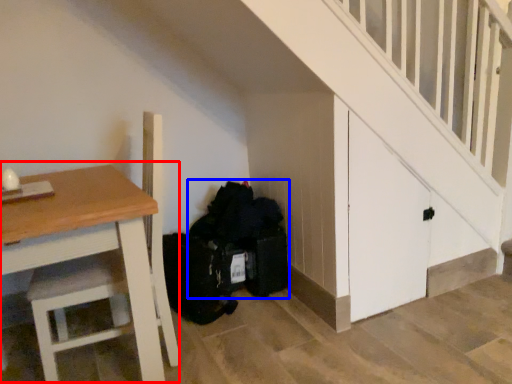
Question: Among these objects, which one is nearest to the camera, table (highlighted by a red box) or garbage (highlighted by a blue box)?

Choices:
 (A) table
 (B) garbage

Answer: (A)